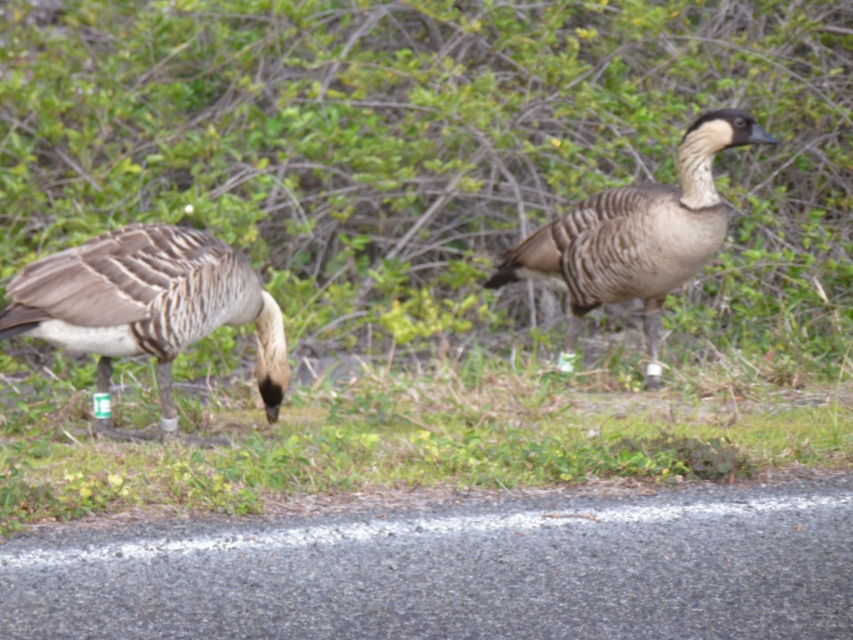
Question: In this image, where is brown feathered goose at left located relative to brown speckled goose at center?

Choices:
 (A) left
 (B) right

Answer: (A)

Question: Is green grass at lower center in front of brown speckled goose at center?

Choices:
 (A) yes
 (B) no

Answer: (A)

Question: Estimate the real-world distances between objects in this image. Which object is farther from the brown feathered goose at left?

Choices:
 (A) brown speckled goose at center
 (B) green grass at lower center

Answer: (A)

Question: From the image, what is the correct spatial relationship of green grass at lower center in relation to brown speckled goose at center?

Choices:
 (A) right
 (B) left

Answer: (B)

Question: Which of the following is the closest to the observer?

Choices:
 (A) (117, 232)
 (B) (654, 202)
 (C) (326, 442)

Answer: (C)

Question: Which object is the closest to the brown speckled goose at center?

Choices:
 (A) brown feathered goose at left
 (B) green grass at lower center

Answer: (B)